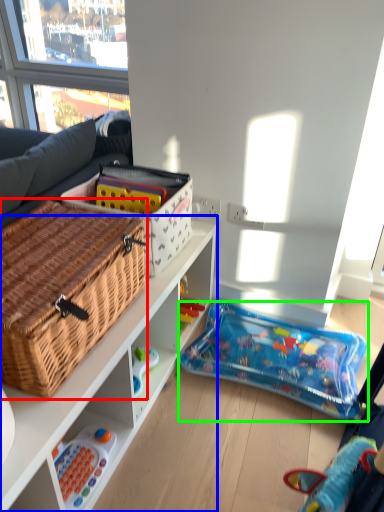
Question: Which object is the farthest from picnic basket (highlighted by a red box)? Choose among these: cabinetry (highlighted by a blue box) or toy (highlighted by a green box).

Choices:
 (A) cabinetry
 (B) toy

Answer: (B)